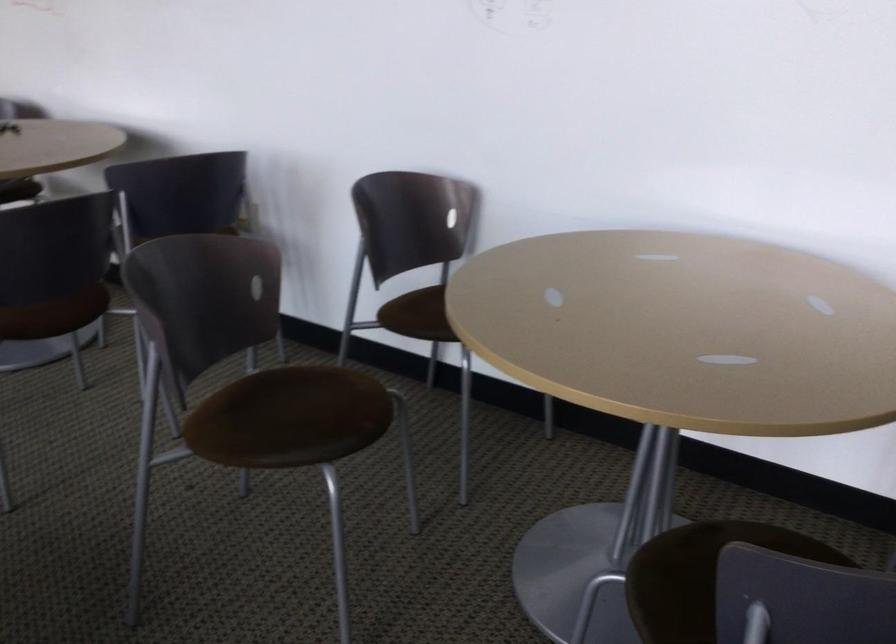
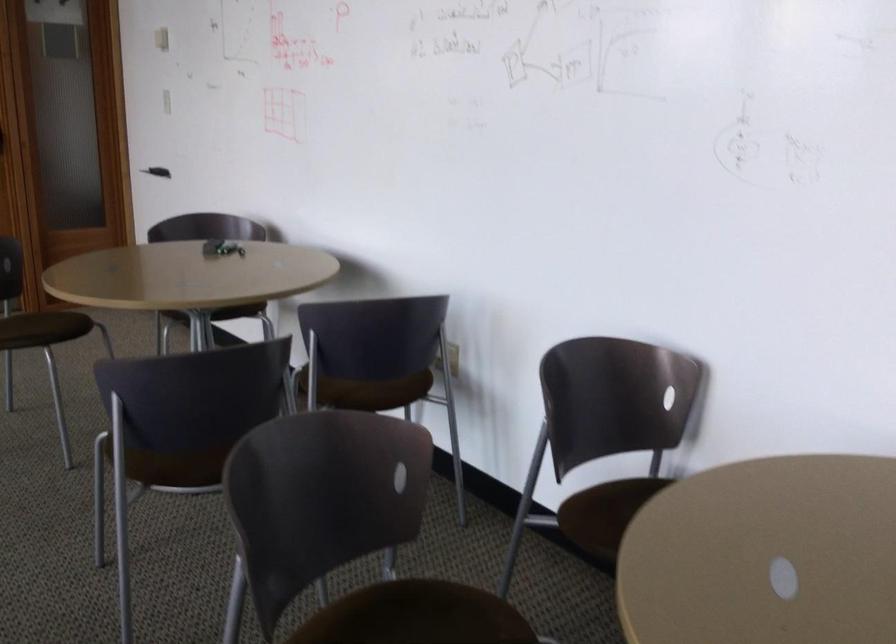
Where in the second image is the point corresponding to (288,386) from the first image?

(418, 612)